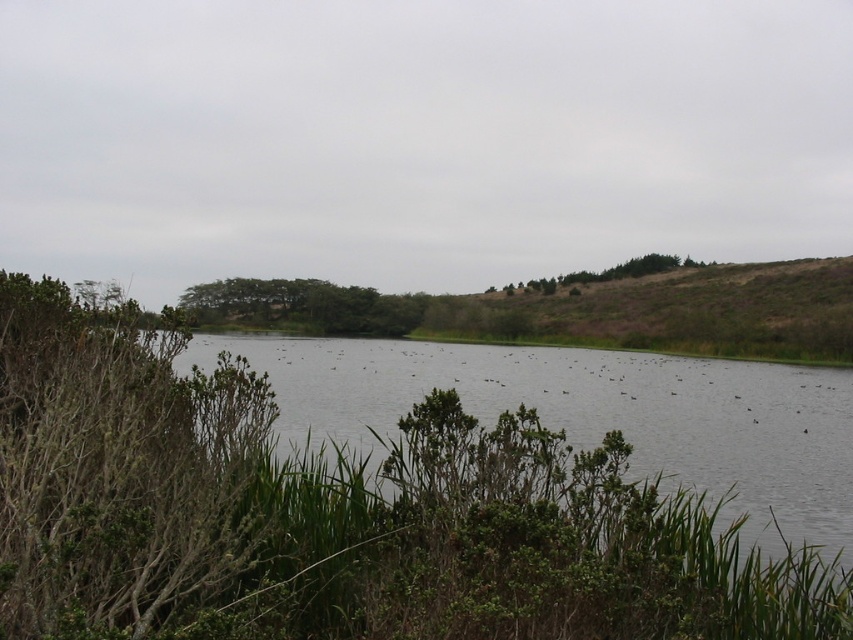
Measure the distance from clear water at center to green leafy tree at center.

They are 20.04 meters apart.

Is point (682, 378) more distant than point (350, 305)?

That is False.

What are the coordinates of `clear water at center` in the screenshot? It's located at (592, 413).

Is clear water at center below green leafy tree at upper center?

Yes, clear water at center is below green leafy tree at upper center.

Who is taller, clear water at center or green leafy tree at upper center?

Standing taller between the two is green leafy tree at upper center.

This screenshot has height=640, width=853. In order to click on clear water at center in this screenshot , I will do `click(592, 413)`.

Is green leafy tree at center in front of green leafy tree at upper center?

Yes, green leafy tree at center is in front of green leafy tree at upper center.

Based on the photo, which of these two, green leafy tree at center or green leafy tree at upper center, stands taller?

Standing taller between the two is green leafy tree at upper center.

Find the location of a particular element. Image resolution: width=853 pixels, height=640 pixels. green leafy tree at center is located at coordinates [302, 307].